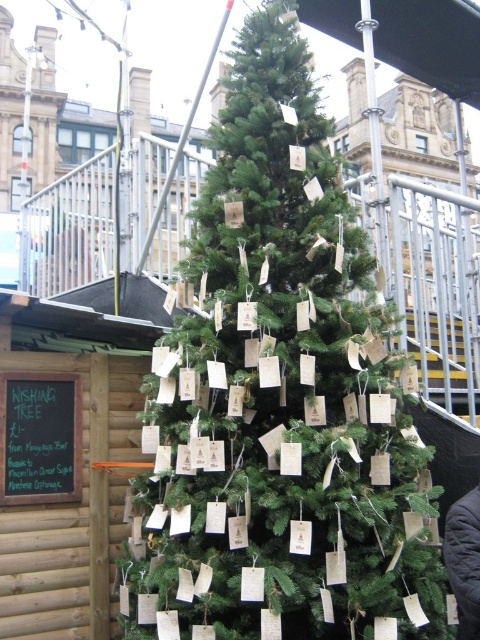
You are a visitor at the event and want to read the sign on the black chalkboard at left. Which direction should you move relative to the green matte christmas tree at center?

The green matte christmas tree at center is positioned on the right side of black chalkboard at left, so you should move to the left of the green matte christmas tree at center to reach the black chalkboard at left.

You are a visitor at the festive scene and want to take a photo of the green matte christmas tree at center without any distractions. Since the black chalkboard at left is in the background, will it be visible in your photo?

The green matte christmas tree at center is in front of the black chalkboard at left, so the chalkboard will be visible in the background of the photo.